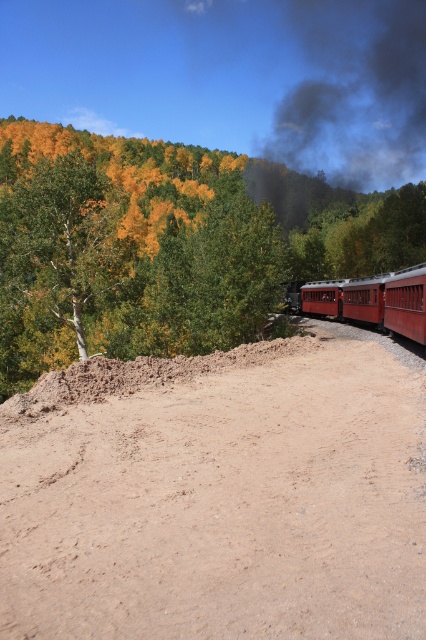
You are a hiker who wants to take a photo of the smooth white tree at left from the brown sandy dirt track at lower center. Are you able to stand on the track to take the photo without needing to move far?

The brown sandy dirt track at lower center is located below smooth white tree at left, so yes, you can stand on the track to take the photo as it is positioned directly underneath the tree.

You are a photographer planning to capture the train in the scene. You notice the dark gray smoke at upper center and the red polished wood train at right. Which object is closer to the right edge of the photo frame?

The red polished wood train at right is closer to the right edge of the photo frame because the dark gray smoke at upper center is positioned on the right side of it, meaning the train itself is positioned to the left of the smoke.

You are a photographer trying to capture the dark gray smoke at upper center in the image. Based on its 2D coordinates, where should you position your camera to ensure it is centered in your shot?

The dark gray smoke at upper center is located at coordinates point (351,92), so you should position your camera to center the shot at those coordinates to capture it.